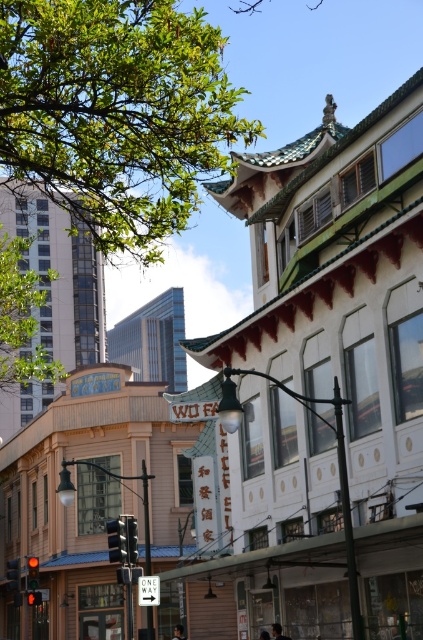
Is point (286, 637) positioned in front of point (268, 632)?

Yes, it is.

Is point (282, 636) positioned after point (263, 634)?

No.

Who is more distant from viewer, (280,637) or (264,637)?

Positioned behind is point (264,637).

The height and width of the screenshot is (640, 423). Find the location of `dark brown hair at lower center`. dark brown hair at lower center is located at coordinates (277, 632).

Is dark hair person at center to the left of smooth skin face at center from the viewer's perspective?

Indeed, dark hair person at center is positioned on the left side of smooth skin face at center.

Is dark hair person at center wider than smooth skin face at center?

Correct, the width of dark hair person at center exceeds that of smooth skin face at center.

Identify the location of dark hair person at center. The image size is (423, 640). (178, 632).

Where is `dark hair person at center`? The height and width of the screenshot is (640, 423). dark hair person at center is located at coordinates (178, 632).

Does dark brown hair at lower center appear over dark hair person at center?

Indeed, dark brown hair at lower center is positioned over dark hair person at center.

Is point (275, 637) behind point (180, 636)?

No, (275, 637) is closer to viewer.

The image size is (423, 640). What are the coordinates of `dark brown hair at lower center` in the screenshot? It's located at (277, 632).